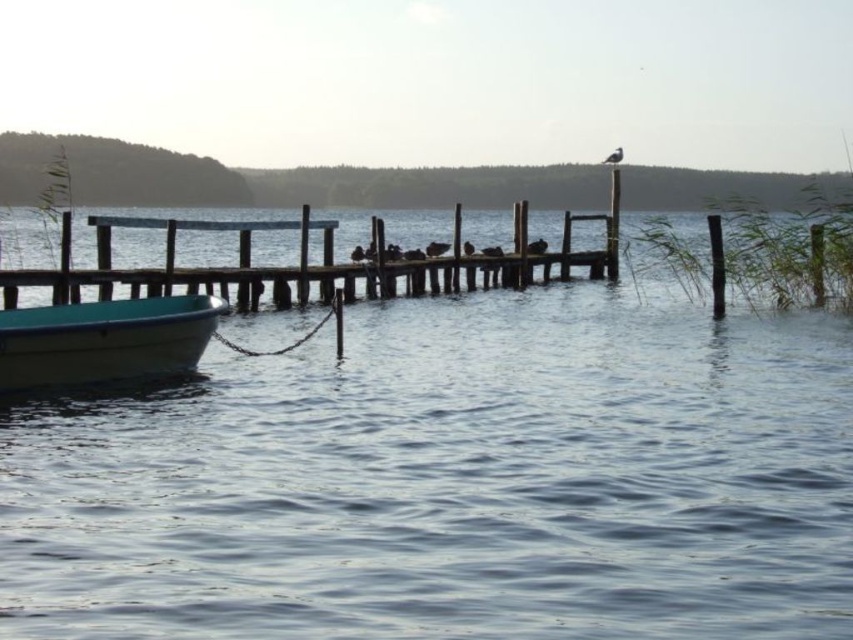
Which is more to the right, clear blue water at center or white plastic boat at lower left?

clear blue water at center

Is clear blue water at center wider than white plastic boat at lower left?

Yes, clear blue water at center is wider than white plastic boat at lower left.

Identify the location of clear blue water at center. (453, 481).